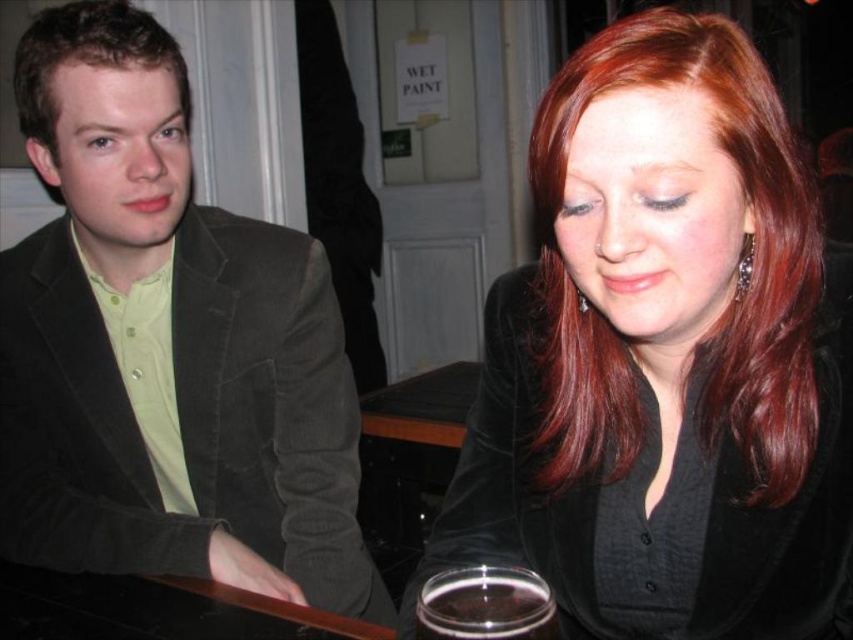
Question: Which is nearer to the shiny red hair at upper right?

Choices:
 (A) black velvet blazer at center
 (B) velvet green blazer at left
 (C) brown velvety hair at left
 (D) clear glass cup at lower center

Answer: (A)

Question: Is black velvet blazer at center smaller than brown velvety hair at left?

Choices:
 (A) yes
 (B) no

Answer: (B)

Question: Estimate the real-world distances between objects in this image. Which object is farther from the brown velvety hair at left?

Choices:
 (A) black velvet blazer at center
 (B) velvet green blazer at left

Answer: (A)

Question: Is the position of shiny red hair at upper right less distant than that of black velvet blazer at center?

Choices:
 (A) no
 (B) yes

Answer: (B)

Question: Does velvet green blazer at left have a greater width compared to brown velvety hair at left?

Choices:
 (A) yes
 (B) no

Answer: (A)

Question: Which point appears closest to the camera in this image?

Choices:
 (A) (712, 45)
 (B) (161, 323)
 (C) (495, 566)

Answer: (C)